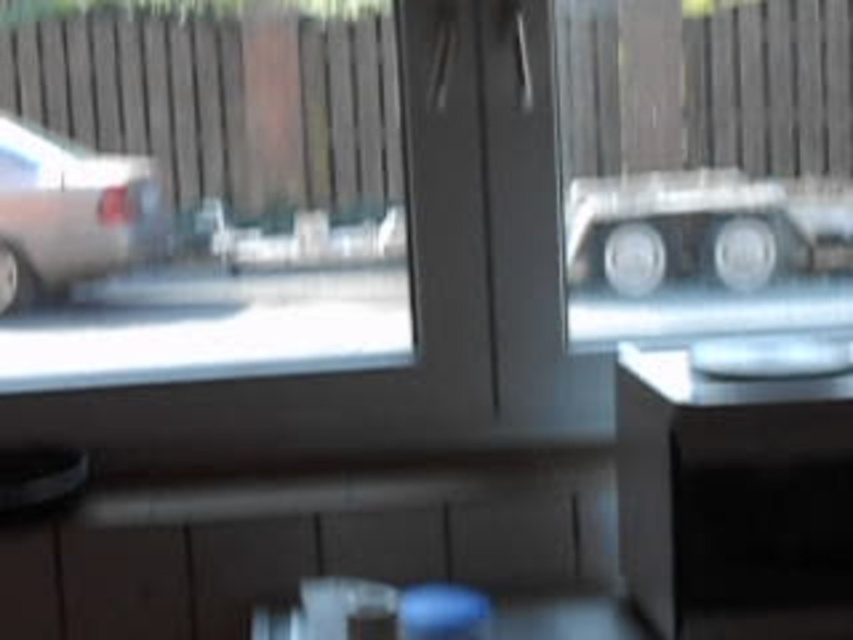
Is clear glass window at upper left closer to camera compared to silver metallic car at left?

That is False.

Consider the image. Is clear glass window at upper left smaller than silver metallic car at left?

Incorrect, clear glass window at upper left is not smaller in size than silver metallic car at left.

Between point (241, 52) and point (45, 220), which one is positioned behind?

The point (241, 52) is behind.

This screenshot has width=853, height=640. Identify the location of clear glass window at upper left. (202, 196).